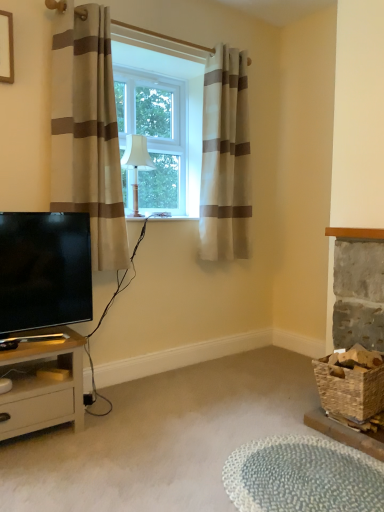
Where is `vacant area to the left of rustic woven basket at lower right`? vacant area to the left of rustic woven basket at lower right is located at coordinates (307, 434).